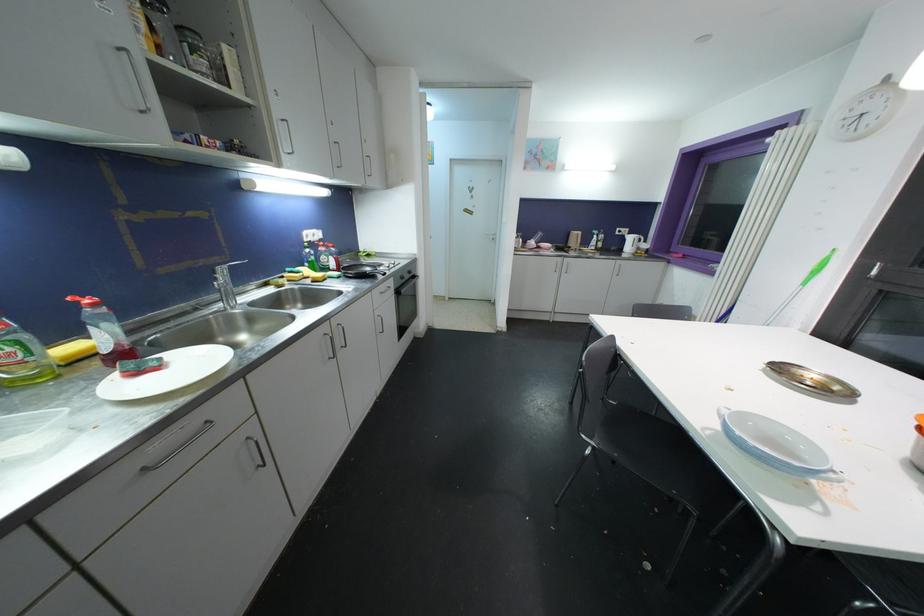
You are a GUI agent. You are given a task and a screenshot of the screen. Output one action in this format:
    pyautogui.click(x=<x>, y=<y>)
    Task: Click on the green handled mop
    Image resolution: width=924 pixels, height=616 pixels.
    Given the screenshot: What is the action you would take?
    pyautogui.click(x=801, y=284)